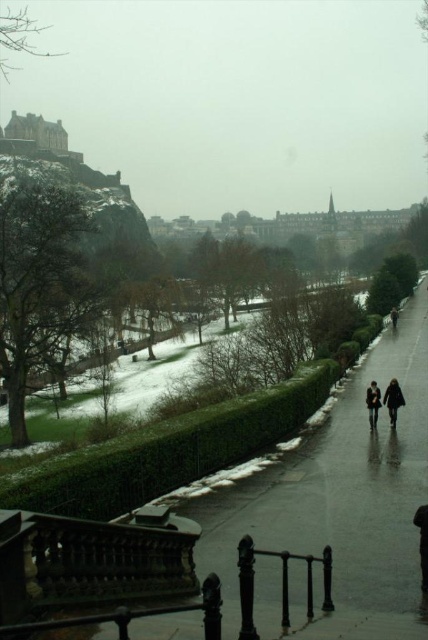
What do you see at coordinates (422, 544) in the screenshot? The width and height of the screenshot is (428, 640). I see `dark gray coat at lower right` at bounding box center [422, 544].

Which is more to the right, dark gray coat at lower right or dark fabric coat at center?

From the viewer's perspective, dark fabric coat at center appears more on the right side.

Is point (427, 557) behind point (391, 390)?

No, it is not.

Find the location of `dark gray coat at lower right`. dark gray coat at lower right is located at coordinates (422, 544).

Can you confirm if dark gray coat at center is positioned above dark gray coat at lower right?

Correct, dark gray coat at center is located above dark gray coat at lower right.

Can you confirm if dark gray coat at center is positioned below dark gray coat at lower right?

No.

Find the location of `dark gray coat at center`. dark gray coat at center is located at coordinates (392, 400).

Where is `dark gray coat at center`? dark gray coat at center is located at coordinates point(392,400).

Between dark fabric coat at center and dark brown leather coat at lower center, which one has more height?

dark brown leather coat at lower center is taller.

Is dark fabric coat at center smaller than dark brown leather coat at lower center?

Correct, dark fabric coat at center occupies less space than dark brown leather coat at lower center.

The height and width of the screenshot is (640, 428). I want to click on dark fabric coat at center, so click(392, 400).